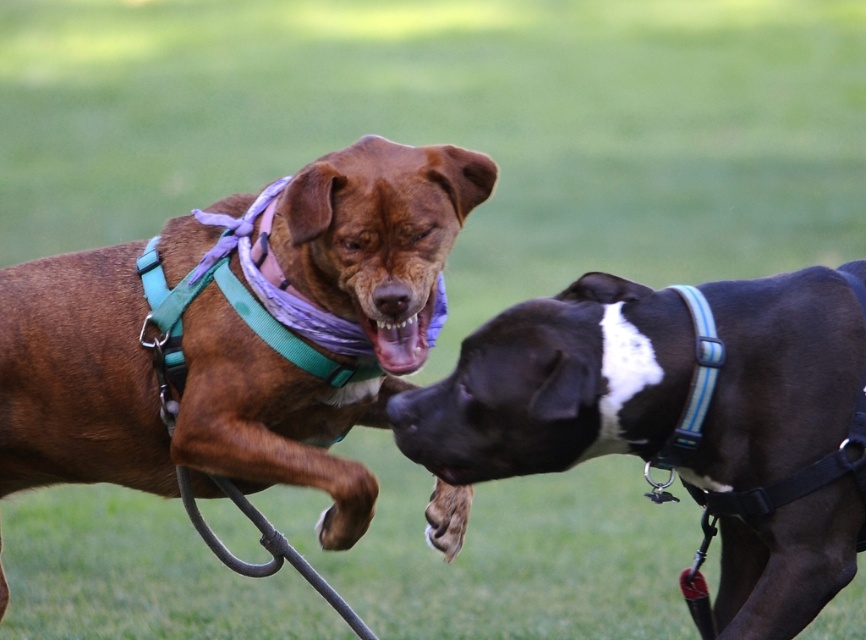
Which is below, black smooth dog at right or matte brown dog mouth at center?

black smooth dog at right is below.

Can you confirm if black smooth dog at right is positioned below matte brown dog mouth at center?

Yes, black smooth dog at right is below matte brown dog mouth at center.

Who is more distant from viewer, (724, 417) or (391, 339)?

Point (391, 339)

The width and height of the screenshot is (866, 640). Identify the location of black smooth dog at right. (554, 385).

Does brown leather harness at center have a smaller size compared to black smooth dog at right?

No.

Locate an element on the screen. The width and height of the screenshot is (866, 640). brown leather harness at center is located at coordinates (158, 397).

Image resolution: width=866 pixels, height=640 pixels. What are the coordinates of `brown leather harness at center` in the screenshot? It's located at (158, 397).

The image size is (866, 640). Find the location of `brown leather harness at center`. brown leather harness at center is located at coordinates (158, 397).

Does brown leather harness at center appear on the left side of matte brown dog mouth at center?

Indeed, brown leather harness at center is positioned on the left side of matte brown dog mouth at center.

The width and height of the screenshot is (866, 640). Describe the element at coordinates (158, 397) in the screenshot. I see `brown leather harness at center` at that location.

At what (x,y) coordinates should I click in order to perform the action: click on brown leather harness at center. Please return your answer as a coordinate pair (x, y). The width and height of the screenshot is (866, 640). Looking at the image, I should click on (158, 397).